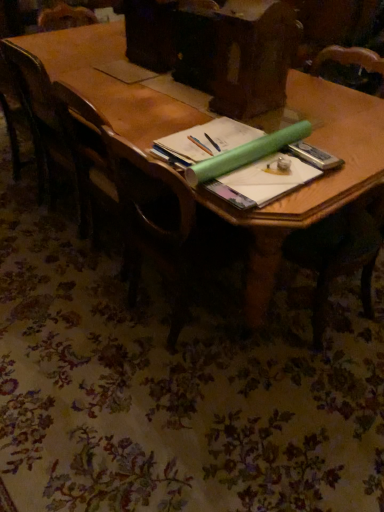
Question: Is wooden table at center closer to the viewer compared to wooden chair at left, the first chair in the back-to-front sequence?

Choices:
 (A) yes
 (B) no

Answer: (A)

Question: Does wooden table at center turn towards wooden chair at left, positioned as the first chair in left-to-right order?

Choices:
 (A) yes
 (B) no

Answer: (B)

Question: Is wooden table at center looking in the opposite direction of wooden chair at left, positioned as the 2th chair in front-to-back order?

Choices:
 (A) no
 (B) yes

Answer: (A)

Question: Is wooden table at center thinner than wooden chair at left, positioned as the first chair in left-to-right order?

Choices:
 (A) no
 (B) yes

Answer: (A)

Question: Is wooden table at center taller than wooden chair at left, the 2th chair from the right?

Choices:
 (A) yes
 (B) no

Answer: (B)

Question: Are wooden table at center and wooden chair at left, positioned as the 2th chair in front-to-back order, making contact?

Choices:
 (A) yes
 (B) no

Answer: (B)

Question: Does wooden chair at left, the 2th chair from the right, appear on the right side of wooden table at center?

Choices:
 (A) yes
 (B) no

Answer: (B)

Question: Is wooden chair at left, the first chair in the back-to-front sequence, positioned behind wooden table at center?

Choices:
 (A) yes
 (B) no

Answer: (A)

Question: Does wooden chair at left, the first chair in the back-to-front sequence, have a greater width compared to wooden table at center?

Choices:
 (A) no
 (B) yes

Answer: (A)

Question: Could you tell me if wooden chair at left, the 2th chair from the right, is facing wooden table at center?

Choices:
 (A) no
 (B) yes

Answer: (B)

Question: Are wooden chair at left, the 2th chair from the right, and wooden table at center far apart?

Choices:
 (A) yes
 (B) no

Answer: (B)

Question: From the image's perspective, does wooden chair at left, positioned as the first chair in left-to-right order, appear higher than wooden table at center?

Choices:
 (A) no
 (B) yes

Answer: (B)

Question: Is the surface of wooden table at center in direct contact with wooden chair at center, the 1th chair viewed from the right?

Choices:
 (A) no
 (B) yes

Answer: (A)